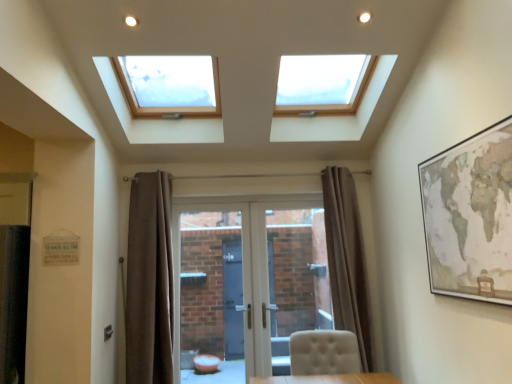
Question: Is brown fabric curtain at left, the 1th curtain viewed from the left, taller or shorter than brown fabric curtain at center, positioned as the second curtain in left-to-right order?

Choices:
 (A) short
 (B) tall

Answer: (B)

Question: Choose the correct answer: Is brown fabric curtain at left, the second curtain when ordered from right to left, inside brown fabric curtain at center, positioned as the second curtain in left-to-right order, or outside it?

Choices:
 (A) outside
 (B) inside

Answer: (A)

Question: Estimate the real-world distances between objects in this image. Which object is closer to the matte brown map at right?

Choices:
 (A) white tufted chair at lower center
 (B) brown fabric curtain at center, positioned as the second curtain in left-to-right order
 (C) white glossy door at center
 (D) brown fabric curtain at left, the second curtain when ordered from right to left

Answer: (A)

Question: Which is farther from the brown fabric curtain at left, the second curtain when ordered from right to left?

Choices:
 (A) brown fabric curtain at center, positioned as the second curtain in left-to-right order
 (B) matte brown map at right
 (C) white tufted chair at lower center
 (D) white glossy door at center

Answer: (B)